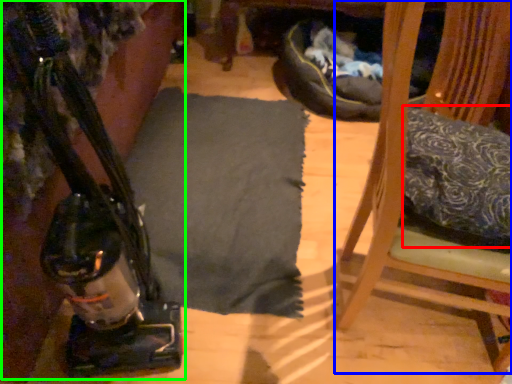
Question: Which is farther away from pillow (highlighted by a red box)? furniture (highlighted by a blue box) or job (highlighted by a green box)?

Choices:
 (A) furniture
 (B) job

Answer: (B)